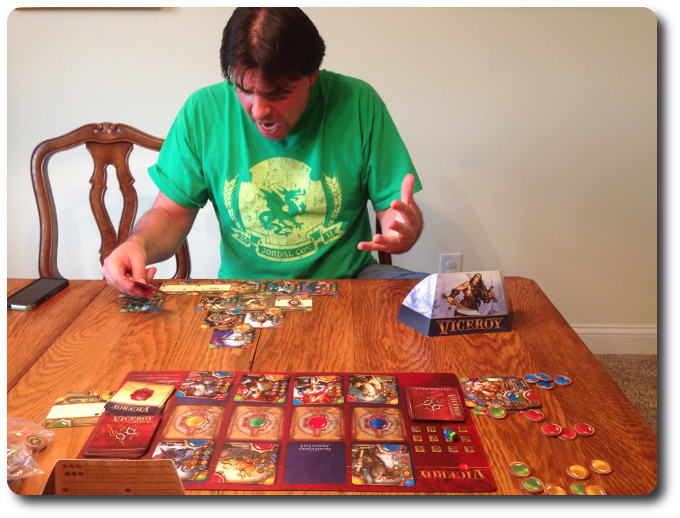
Image resolution: width=680 pixels, height=518 pixels. Find the location of `chair`. chair is located at coordinates [114, 154].